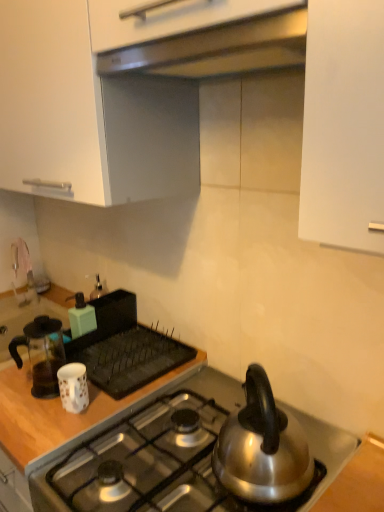
Image resolution: width=384 pixels, height=512 pixels. Identify the location of free spot to the right of matte green soap dispenser at upper left, arranged as the 3th kitchen appliance when viewed from the front. (128, 344).